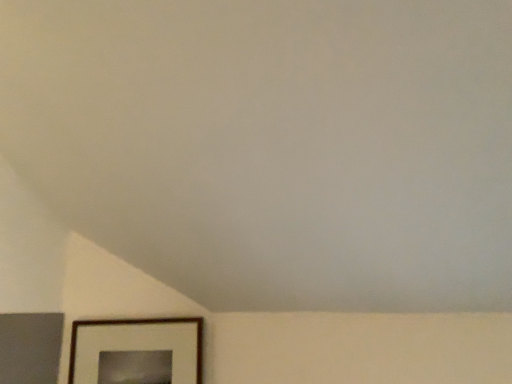
At what (x,y) coordinates should I click in order to perform the action: click on brown wooden picture frame at lower left. Please return your answer as a coordinate pair (x, y). The width and height of the screenshot is (512, 384). Looking at the image, I should click on (136, 351).

Measure the distance between brown wooden picture frame at lower left and camera.

A distance of 5.52 feet exists between brown wooden picture frame at lower left and camera.

This screenshot has height=384, width=512. Describe the element at coordinates (136, 351) in the screenshot. I see `brown wooden picture frame at lower left` at that location.

Find the location of a particular element. This screenshot has height=384, width=512. brown wooden picture frame at lower left is located at coordinates (136, 351).